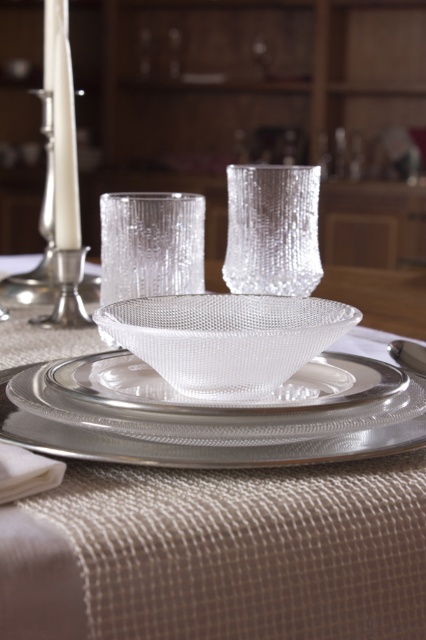
Consider the image. You are a server arranging a dining table and need to place a decorative napkin. The napkin must be placed between the satin silver platter at center and the clear textured glass at center. According to the current arrangement, where should you position the napkin?

The satin silver platter at center is positioned on the right side of clear textured glass at center, so the napkin should be placed between them, to the right of the clear textured glass at center and to the left of the satin silver platter at center.

From the picture: You are a guest at a formal dinner and notice the satin silver saucer at center and the clear textured glass at center on your place setting. Which object is closer to you when sitting at the table?

The satin silver saucer at center is closer to you because it is positioned in front of the clear textured glass at center.

Please describe the object located at the coordinates point (x=230, y=396) in the image.

The object at point (x=230, y=396) is a satin silver saucer at center.